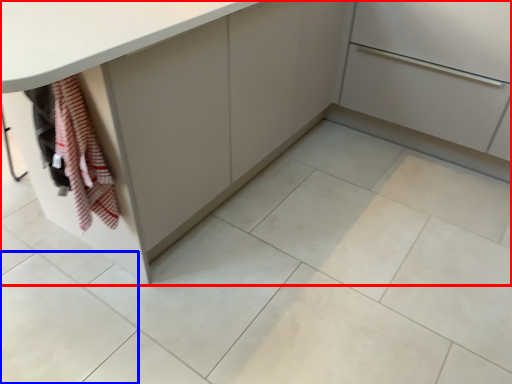
Question: Among these objects, which one is farthest to the camera, cabinetry (highlighted by a red box) or ceramic tile (highlighted by a blue box)?

Choices:
 (A) cabinetry
 (B) ceramic tile

Answer: (B)